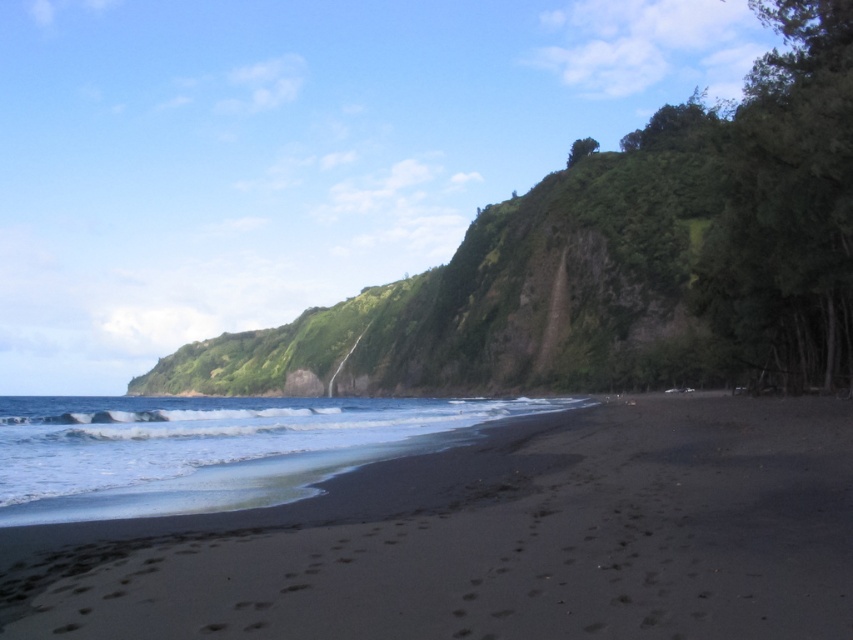
Between black sand at lower center and clear water at lower left, which one has more height?

clear water at lower left

Who is positioned more to the left, black sand at lower center or clear water at lower left?

clear water at lower left is more to the left.

Is point (808, 428) farther from camera compared to point (328, 470)?

Yes, point (808, 428) is behind point (328, 470).

The width and height of the screenshot is (853, 640). I want to click on black sand at lower center, so click(492, 540).